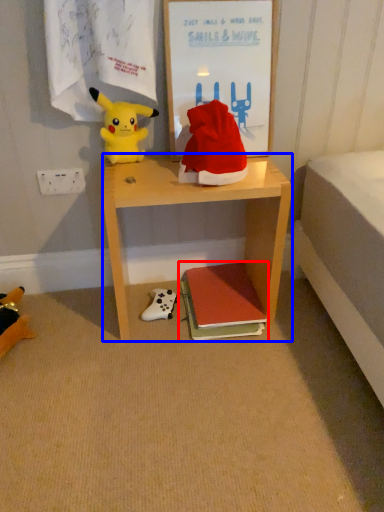
Question: Which object is closer to the camera taking this photo, book (highlighted by a red box) or desk (highlighted by a blue box)?

Choices:
 (A) book
 (B) desk

Answer: (B)